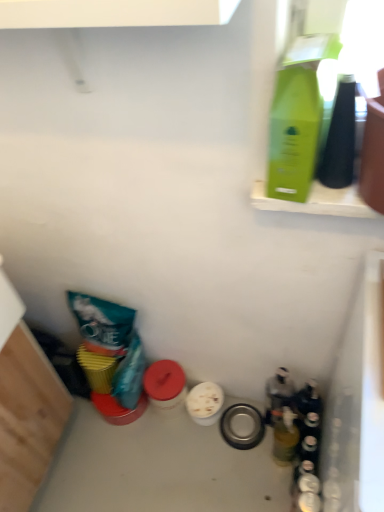
How much space does green matte bottle at upper right, which is counted as the first bottle, starting from the front, occupy horizontally?

green matte bottle at upper right, which is counted as the first bottle, starting from the front, is 3.73 inches in width.

Locate an element on the screen. This screenshot has height=512, width=384. translucent glass bottle at lower right, the 1th bottle positioned from the back is located at coordinates (278, 393).

Identify the location of green matte bottle at upper right, the 3th bottle in the back-to-front sequence. The height and width of the screenshot is (512, 384). (300, 114).

Who is more distant, green matte bottle at upper right, which is counted as the first bottle, starting from the front, or translucent glass bottle at lower right, arranged as the 3th bottle when viewed from the front?

translucent glass bottle at lower right, arranged as the 3th bottle when viewed from the front, is further from the camera.

Is green matte bottle at upper right, the 3th bottle in the back-to-front sequence, facing towards translucent glass bottle at lower right, which appears as the second bottle when ordered from the bottom?

No, green matte bottle at upper right, the 3th bottle in the back-to-front sequence, is not facing towards translucent glass bottle at lower right, which appears as the second bottle when ordered from the bottom.

From the image's perspective, is green matte bottle at upper right, the 3th bottle in the back-to-front sequence, above translucent glass bottle at lower right, which is the 2th bottle in top-to-bottom order?

Yes, from the image's perspective, green matte bottle at upper right, the 3th bottle in the back-to-front sequence, is over translucent glass bottle at lower right, which is the 2th bottle in top-to-bottom order.

Is translucent glass bottle at lower right, the 1th bottle positioned from the back, in contact with green matte bottle at upper right, the 3th bottle in the back-to-front sequence?

No.

How different are the orientations of translucent glass bottle at lower right, the 1th bottle positioned from the back, and green matte bottle at upper right, placed as the third bottle when sorted from bottom to top, in degrees?

The facing directions of translucent glass bottle at lower right, the 1th bottle positioned from the back, and green matte bottle at upper right, placed as the third bottle when sorted from bottom to top, are 84.6 degrees apart.

Is translucent glass bottle at lower right, which is the 2th bottle in top-to-bottom order, looking in the opposite direction of green matte bottle at upper right, the 3th bottle in the back-to-front sequence?

No, translucent glass bottle at lower right, which is the 2th bottle in top-to-bottom order, is not facing the opposite direction of green matte bottle at upper right, the 3th bottle in the back-to-front sequence.

Which object is further away from the camera taking this photo, translucent glass bottle at lower right, the 2th bottle from the back, or translucent glass bottle at lower right, which appears as the second bottle when ordered from the bottom?

Positioned behind is translucent glass bottle at lower right, which appears as the second bottle when ordered from the bottom.

Is translucent glass bottle at lower right, which is the third bottle in top-to-bottom order, next to translucent glass bottle at lower right, which appears as the second bottle when ordered from the bottom, and touching it?

Yes, translucent glass bottle at lower right, which is the third bottle in top-to-bottom order, is touching translucent glass bottle at lower right, which appears as the second bottle when ordered from the bottom.

Between point (282, 459) and point (270, 402), which one is positioned in front?

The point (270, 402) is closer to the camera.

Considering the relative sizes of translucent glass bottle at lower right, which is the 2th bottle in top-to-bottom order, and translucent glass bottle at lower right, which is the third bottle in top-to-bottom order, in the image provided, is translucent glass bottle at lower right, which is the 2th bottle in top-to-bottom order, thinner than translucent glass bottle at lower right, which is the third bottle in top-to-bottom order,?

Incorrect, the width of translucent glass bottle at lower right, which is the 2th bottle in top-to-bottom order, is not less than that of translucent glass bottle at lower right, which is the third bottle in top-to-bottom order.

From a real-world perspective, between translucent glass bottle at lower right, arranged as the 3th bottle when viewed from the front, and translucent glass bottle at lower right, the 2th bottle from the back, who is vertically lower?

translucent glass bottle at lower right, arranged as the 3th bottle when viewed from the front, is physically lower.

Choose the correct answer: Is translucent glass bottle at lower right, which is the 2th bottle in top-to-bottom order, inside translucent glass bottle at lower right, which ranks as the 1th bottle in bottom-to-top order, or outside it?

translucent glass bottle at lower right, which is the 2th bottle in top-to-bottom order, is spatially situated outside translucent glass bottle at lower right, which ranks as the 1th bottle in bottom-to-top order.

Considering the positions of objects translucent glass bottle at lower right, the 1th bottle positioned from the back, and translucent glass bottle at lower right, which is the third bottle in top-to-bottom order, in the image provided, who is more to the left, translucent glass bottle at lower right, the 1th bottle positioned from the back, or translucent glass bottle at lower right, which is the third bottle in top-to-bottom order,?

translucent glass bottle at lower right, the 1th bottle positioned from the back.

How distant is translucent glass bottle at lower right, which ranks as the 2th bottle in front-to-back order, from green matte bottle at upper right, the 3th bottle in the back-to-front sequence?

translucent glass bottle at lower right, which ranks as the 2th bottle in front-to-back order, is 32.48 inches from green matte bottle at upper right, the 3th bottle in the back-to-front sequence.

Between translucent glass bottle at lower right, which ranks as the 1th bottle in bottom-to-top order, and green matte bottle at upper right, the 3th bottle in the back-to-front sequence, which one appears on the right side from the viewer's perspective?

Positioned to the right is translucent glass bottle at lower right, which ranks as the 1th bottle in bottom-to-top order.

Is translucent glass bottle at lower right, which is the third bottle in top-to-bottom order, positioned with its back to green matte bottle at upper right, placed as the third bottle when sorted from bottom to top?

translucent glass bottle at lower right, which is the third bottle in top-to-bottom order, does not have its back to green matte bottle at upper right, placed as the third bottle when sorted from bottom to top.

From a real-world perspective, is translucent glass bottle at lower right, the 2th bottle from the back, physically located above or below green matte bottle at upper right, which is counted as the first bottle, starting from the front?

translucent glass bottle at lower right, the 2th bottle from the back, is below green matte bottle at upper right, which is counted as the first bottle, starting from the front.

Can you confirm if green matte bottle at upper right, the 3th bottle in the back-to-front sequence, is shorter than translucent glass bottle at lower right, which ranks as the 1th bottle in bottom-to-top order?

Correct, green matte bottle at upper right, the 3th bottle in the back-to-front sequence, is not as tall as translucent glass bottle at lower right, which ranks as the 1th bottle in bottom-to-top order.

Is green matte bottle at upper right, the 3th bottle in the back-to-front sequence, aimed at translucent glass bottle at lower right, the 2th bottle from the back?

No, green matte bottle at upper right, the 3th bottle in the back-to-front sequence, is not oriented towards translucent glass bottle at lower right, the 2th bottle from the back.

Is green matte bottle at upper right, the 3th bottle in the back-to-front sequence, wider or thinner than translucent glass bottle at lower right, the 2th bottle from the back?

green matte bottle at upper right, the 3th bottle in the back-to-front sequence, is wider than translucent glass bottle at lower right, the 2th bottle from the back.

Image resolution: width=384 pixels, height=512 pixels. Find the location of `bottle that is the 1st one when counting downward from the green matte bottle at upper right, which is counted as the first bottle, starting from the front (from the image's perspective)`. bottle that is the 1st one when counting downward from the green matte bottle at upper right, which is counted as the first bottle, starting from the front (from the image's perspective) is located at coordinates (278, 393).

Where is `the 2nd bottle positioned above the translucent glass bottle at lower right, which appears as the second bottle when ordered from the bottom (from a real-world perspective)`? the 2nd bottle positioned above the translucent glass bottle at lower right, which appears as the second bottle when ordered from the bottom (from a real-world perspective) is located at coordinates (300, 114).

When comparing their distances from translucent glass bottle at lower right, the 1th bottle positioned from the back, does translucent glass bottle at lower right, the 2th bottle from the back, or green matte bottle at upper right, which is counted as the first bottle, starting from the front, seem closer?

translucent glass bottle at lower right, the 2th bottle from the back.

From the image, which object appears to be farther from translucent glass bottle at lower right, which ranks as the 1th bottle in bottom-to-top order, green matte bottle at upper right, marked as the 1th bottle in a top-to-bottom arrangement, or translucent glass bottle at lower right, the 1th bottle positioned from the back?

The object further to translucent glass bottle at lower right, which ranks as the 1th bottle in bottom-to-top order, is green matte bottle at upper right, marked as the 1th bottle in a top-to-bottom arrangement.

Considering their positions, is translucent glass bottle at lower right, which ranks as the 1th bottle in bottom-to-top order, positioned closer to green matte bottle at upper right, which is counted as the first bottle, starting from the front, than translucent glass bottle at lower right, which is the 2th bottle in top-to-bottom order?

translucent glass bottle at lower right, which is the 2th bottle in top-to-bottom order.

When comparing their distances from green matte bottle at upper right, the 3th bottle in the back-to-front sequence, does translucent glass bottle at lower right, the 1th bottle positioned from the back, or translucent glass bottle at lower right, which ranks as the 1th bottle in bottom-to-top order, seem closer?

translucent glass bottle at lower right, the 1th bottle positioned from the back, is positioned closer to the anchor green matte bottle at upper right, the 3th bottle in the back-to-front sequence.

From the picture: Which object lies further to the anchor point translucent glass bottle at lower right, which appears as the second bottle when ordered from the bottom, green matte bottle at upper right, which is counted as the first bottle, starting from the front, or translucent glass bottle at lower right, the 2th bottle from the back?

The object further to translucent glass bottle at lower right, which appears as the second bottle when ordered from the bottom, is green matte bottle at upper right, which is counted as the first bottle, starting from the front.

From the image, which object appears to be farther from translucent glass bottle at lower right, which ranks as the 2th bottle in front-to-back order, translucent glass bottle at lower right, which appears as the second bottle when ordered from the bottom, or green matte bottle at upper right, placed as the third bottle when sorted from bottom to top?

Based on the image, green matte bottle at upper right, placed as the third bottle when sorted from bottom to top, appears to be further to translucent glass bottle at lower right, which ranks as the 2th bottle in front-to-back order.

You are a GUI agent. You are given a task and a screenshot of the screen. Output one action in this format:
    pyautogui.click(x=<x>, y=<y>)
    Task: Click on the bottle between green matte bottle at upper right, which is counted as the first bottle, starting from the front, and translucent glass bottle at lower right, which is the third bottle in top-to-bottom order, from top to bottom
    This screenshot has height=512, width=384.
    Given the screenshot: What is the action you would take?
    pyautogui.click(x=278, y=393)